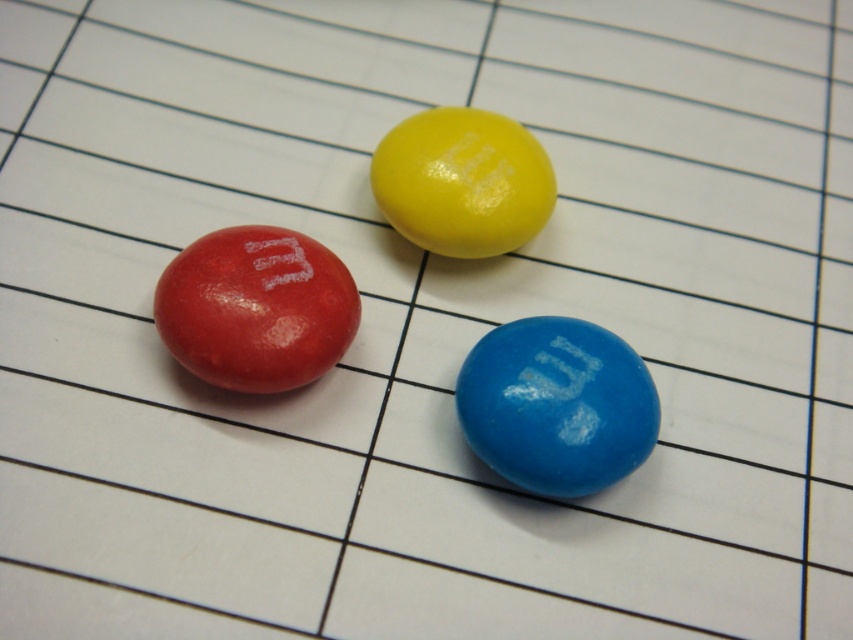
You are looking at the image of the candies on the grid. There are two points marked in the image, point A at point (279, 307) and point B at point (509, 237). Which point is closer to you?

Point A at point (279, 307) is closer to the viewer than point B at point (509, 237).